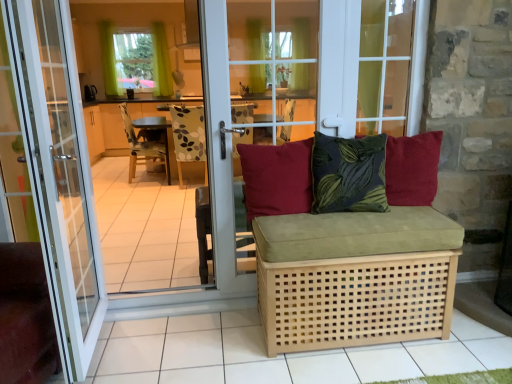
Locate an element on the screen. The height and width of the screenshot is (384, 512). vacant area to the right of white glass door at center is located at coordinates (152, 338).